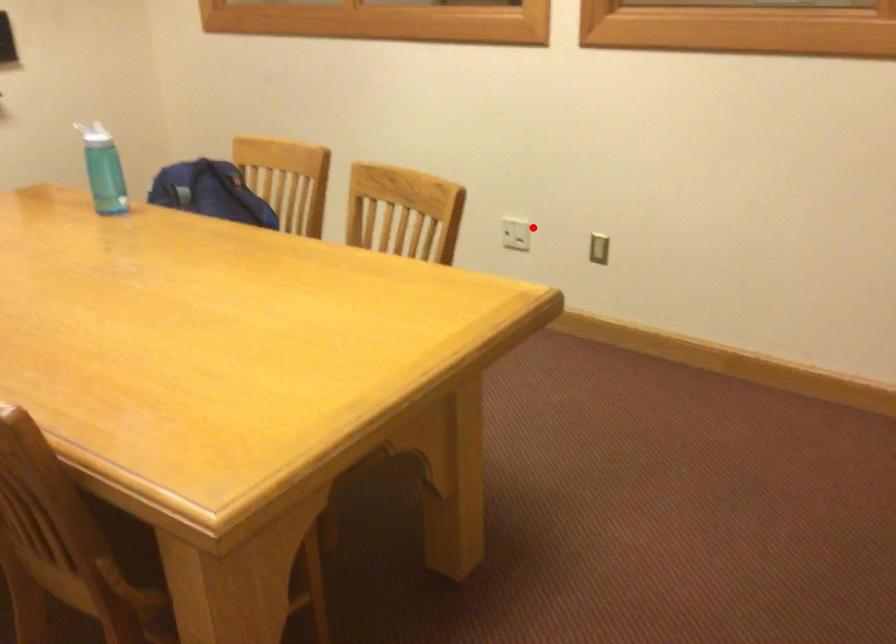
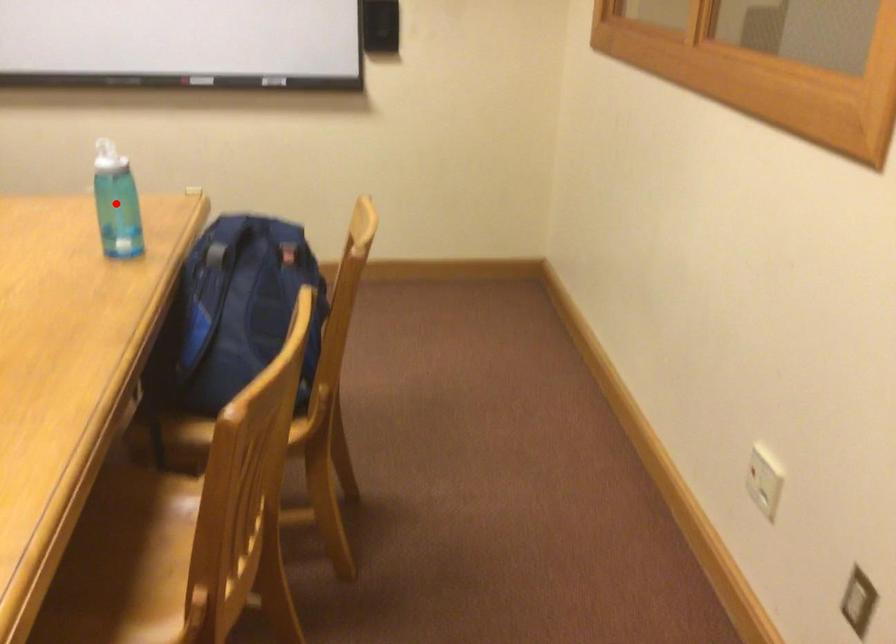
I am providing you with two images of the same scene from different viewpoints. A red point is marked on the first image and another point is marked on the second image. Do the highlighted points in image1 and image2 indicate the same real-world spot?

No